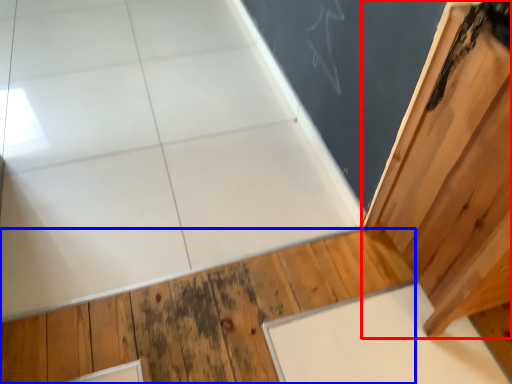
Question: Which point is closer to the camera, door (highlighted by a red box) or hardwood (highlighted by a blue box)?

Choices:
 (A) door
 (B) hardwood

Answer: (A)